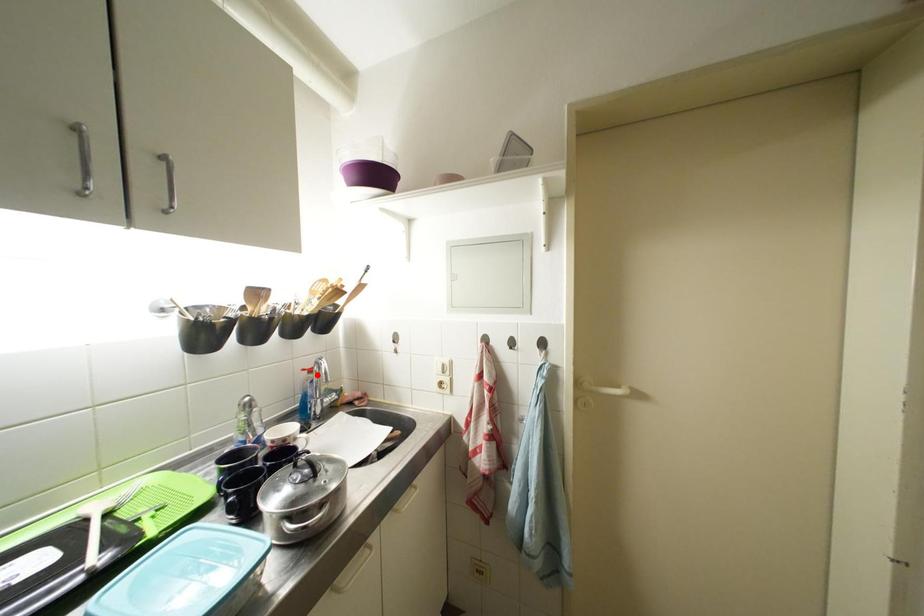
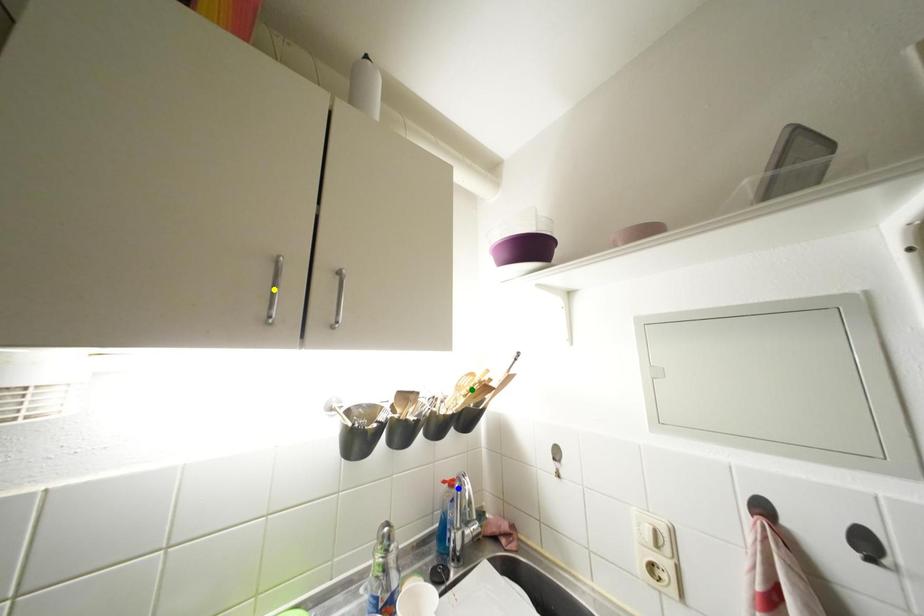
Question: I am providing you with two images of the same scene from different viewpoints. A red point is marked on the first image. You are given multiple points on the second image. Can you choose the point in image 2 that corresponds to the point in image 1?

Choices:
 (A) green point
 (B) blue point
 (C) yellow point

Answer: (B)